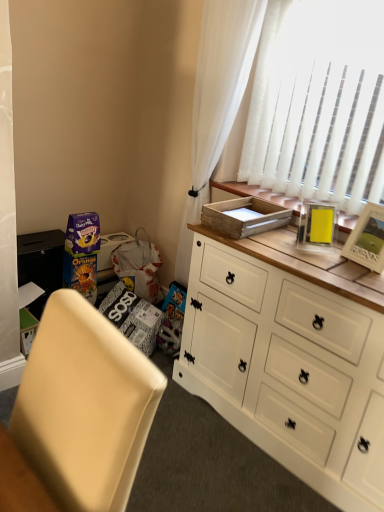
Where is `unoccupied area in front of wooden tray at upper right`? unoccupied area in front of wooden tray at upper right is located at coordinates (278, 247).